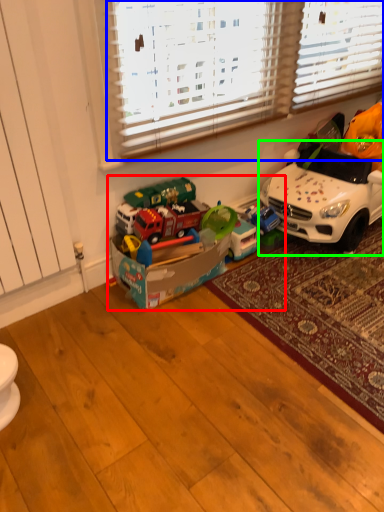
Question: Which object is the closest to the toy (highlighted by a red box)? Choose among these: blind (highlighted by a blue box) or car (highlighted by a green box).

Choices:
 (A) blind
 (B) car

Answer: (B)